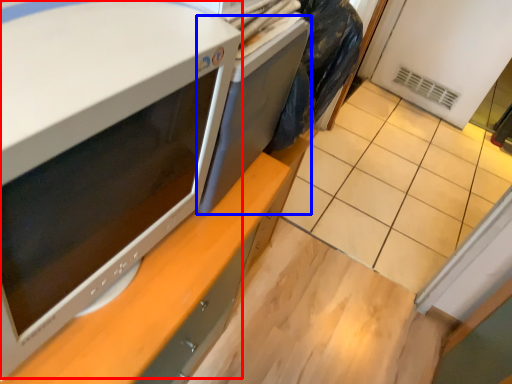
Question: Which object appears farthest to the camera in this image, home appliance (highlighted by a red box) or desktop (highlighted by a blue box)?

Choices:
 (A) home appliance
 (B) desktop

Answer: (B)